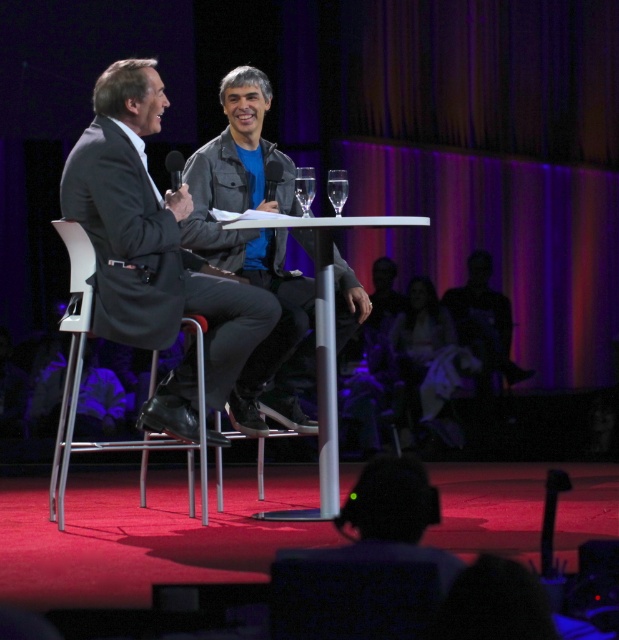
You are a photographer adjusting your camera settings to focus on two specific points on the stage. The points are labeled as point (x=87, y=321) and point (x=329, y=177). Which point should you focus on first if you want to ensure the closest object is in sharp focus?

Point (x=87, y=321) is closer to the camera than point (x=329, y=177), so you should focus on point (x=87, y=321) first to ensure the closest object is in sharp focus.

You are an event organizer who needs to arrange seating for a photo shoot. The dark gray suit at center and the gray leather jacket at center are both in the center of the stage. Which one is closer to the camera?

The dark gray suit at center is in front of the gray leather jacket at center, so the dark gray suit at center is closer to the camera.

You are a stagehand preparing to set up a beverage station behind the two men at the round table. You have two glasses, the clear glass at center and the transparent glass at center. The beverage station requires the taller glass to be placed on the left side. Which glass should you place on the left side?

The clear glass at center has a greater height compared to the transparent glass at center, so you should place the clear glass at center on the left side to meet the beverage station requirement.